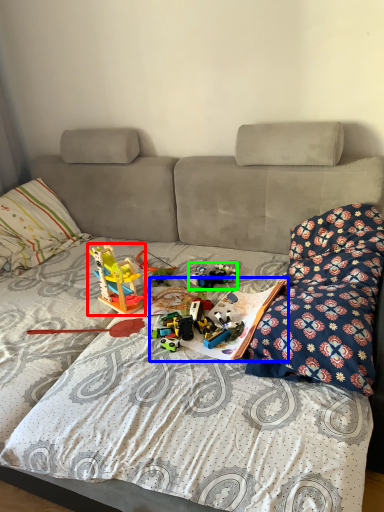
Question: Estimate the real-world distances between objects in this image. Which object is farther from toy (highlighted by a red box), book (highlighted by a blue box) or toy (highlighted by a green box)?

Choices:
 (A) book
 (B) toy

Answer: (A)